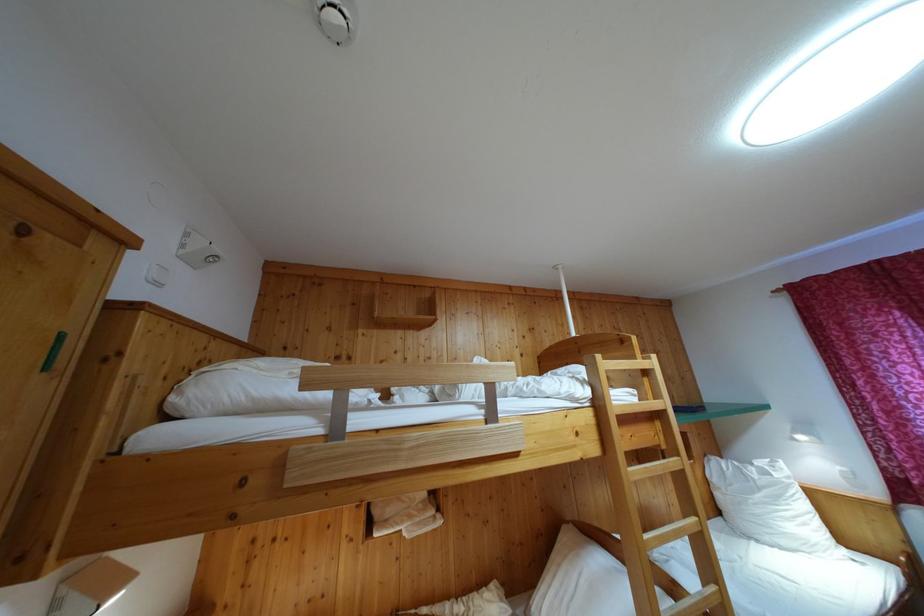
The height and width of the screenshot is (616, 924). Describe the element at coordinates (637, 410) in the screenshot. I see `the wooden ladder rung` at that location.